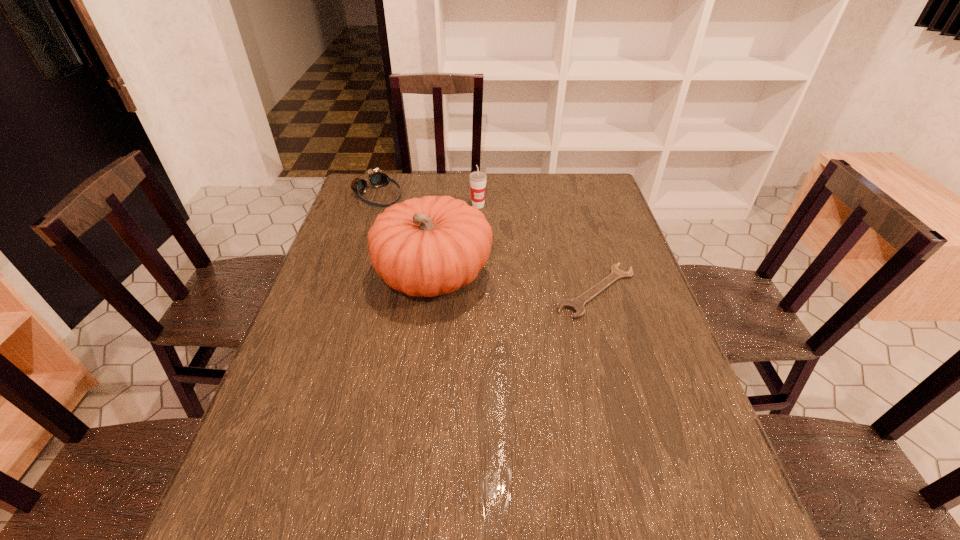
I want to click on the tallest object, so click(x=434, y=245).

This screenshot has width=960, height=540. In order to click on the shortest object in this screenshot , I will do `click(576, 304)`.

I want to click on wrench, so click(576, 304).

Where is `the third shortest object`? The width and height of the screenshot is (960, 540). the third shortest object is located at coordinates (477, 178).

Where is `the second shortest object`? the second shortest object is located at coordinates (377, 179).

Locate an element on the screen. free space located 0.110m on the back of the tallest object is located at coordinates (440, 221).

Where is `vacant position located on the left of the rightmost object`? The height and width of the screenshot is (540, 960). vacant position located on the left of the rightmost object is located at coordinates (421, 291).

I want to click on vacant point located 0.230m on the side of the cup with the logo, so click(x=509, y=249).

Image resolution: width=960 pixels, height=540 pixels. Identify the location of vacant space situated on the side of the cup with the logo. (509, 249).

The height and width of the screenshot is (540, 960). I want to click on vacant space situated 0.150m on the side of the cup with the logo, so (x=498, y=234).